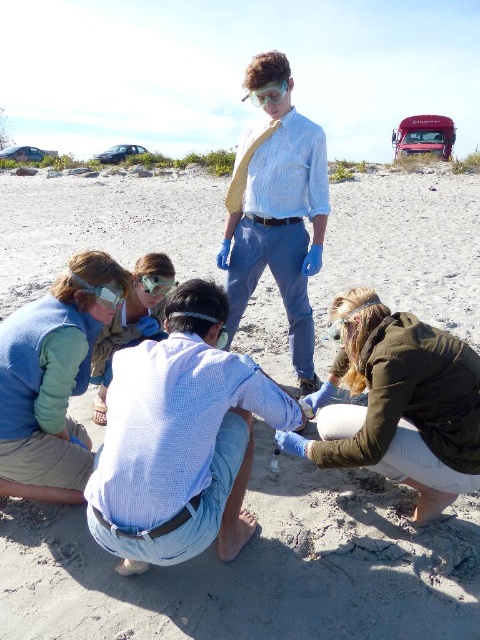
You are standing on the beach and see two points marked on the ground. The first point is at coordinates point (98, 385) and the second is at point (148, 284). Which point is closer to you?

Point (98, 385) is further to the viewer than point (148, 284), so the point closer to you is point (148, 284).

In the scene shown: You are a photographer standing at the camera position and want to capture a closeup shot of the blue checkered shirt at center. The camera has a minimum focusing distance of 6 feet. Can you take the photo without moving closer?

The blue checkered shirt at center is 7.01 feet away from the camera, which is beyond the minimum focusing distance of 6 feet. Therefore, you can take the photo without moving closer.

You are a safety inspector at the beach. You need to ensure that all workers are maintaining a safe distance of at least 2 meters apart for safety protocols. Are the blue checkered shirt at center and light blue shirt at center following the safety distance requirement?

The blue checkered shirt at center and light blue shirt at center are 1.67 meters apart from each other. Since 1.67 meters is less than the required 2 meters, they are not following the safety distance requirement.